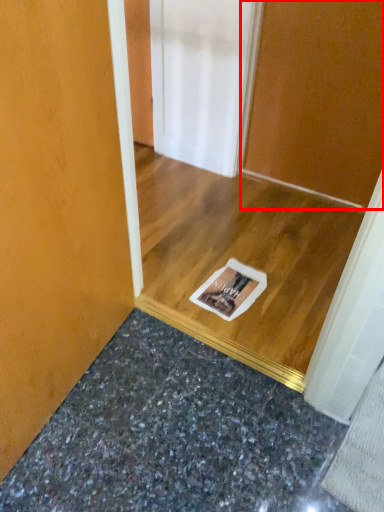
Question: From the image's perspective, what is the correct spatial positioning of door (annotated by the red box) in reference to granite?

Choices:
 (A) above
 (B) below

Answer: (A)